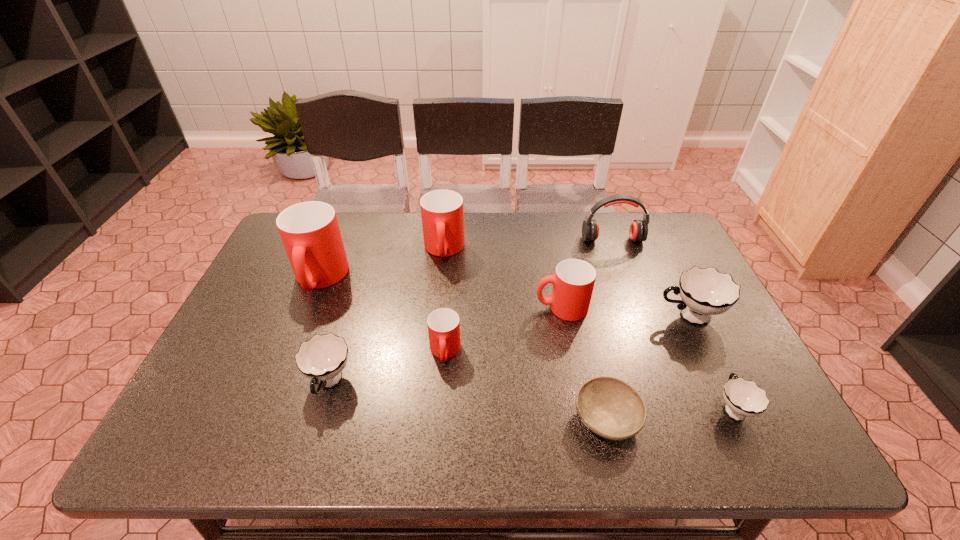
Locate an element on the screen. Image resolution: width=960 pixels, height=540 pixels. vacant region that satisfies the following two spatial constraints: 1. on the side of the shortest object with the handle; 2. on the left side of the leftmost red cup is located at coordinates (264, 419).